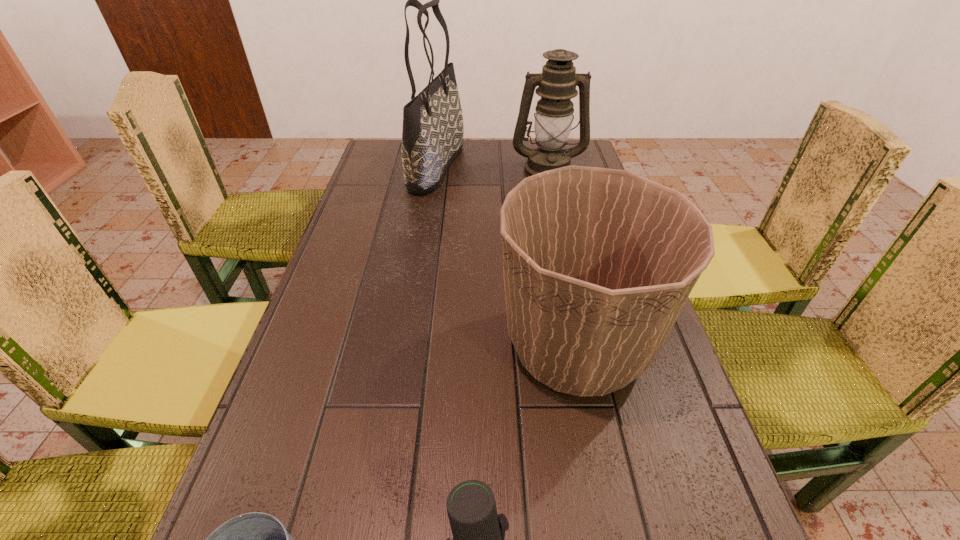
Where is `the tallest object`? The width and height of the screenshot is (960, 540). the tallest object is located at coordinates (432, 136).

Image resolution: width=960 pixels, height=540 pixels. I want to click on the fourth object from right to left, so (x=432, y=136).

The width and height of the screenshot is (960, 540). I want to click on oil lamp, so click(x=557, y=83).

Locate an element on the screen. the third farthest object is located at coordinates (598, 263).

Image resolution: width=960 pixels, height=540 pixels. I want to click on free region located 0.330m on the front of the second object from left to right, so click(x=420, y=272).

Where is `vacant region located on the left of the oil lamp`? Image resolution: width=960 pixels, height=540 pixels. vacant region located on the left of the oil lamp is located at coordinates (459, 169).

Find the location of a particular element. The width and height of the screenshot is (960, 540). free space located on the back of the third nearest object is located at coordinates (555, 240).

This screenshot has height=540, width=960. What are the coordinates of `tote bag present at the far edge` in the screenshot? It's located at (432, 136).

The image size is (960, 540). I want to click on oil lamp that is at the far edge, so click(x=557, y=83).

Find the location of a particular element. The height and width of the screenshot is (540, 960). object present at the left edge is located at coordinates (432, 136).